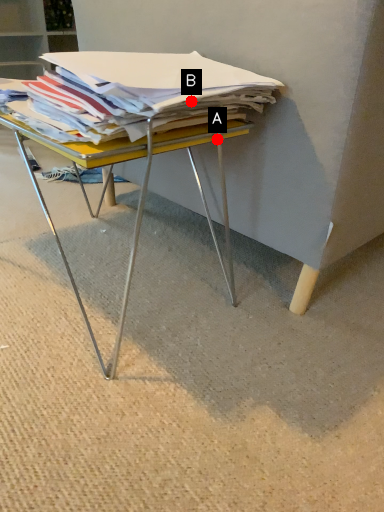
Question: Two points are circled on the image, labeled by A and B beside each circle. Which point is farther from the camera taking this photo?

Choices:
 (A) A is further
 (B) B is further

Answer: (A)